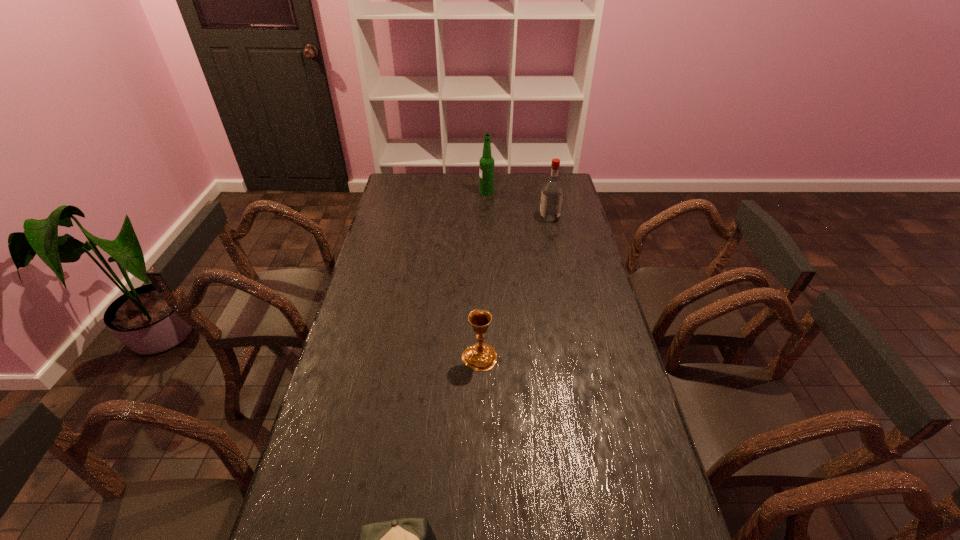
You are a GUI agent. You are given a task and a screenshot of the screen. Output one action in this format:
    pyautogui.click(x=<x>, y=<y>)
    Task: Click on the free space between the third farthest object and the beer bottle
    Image resolution: width=960 pixels, height=540 pixels.
    Given the screenshot: What is the action you would take?
    pyautogui.click(x=483, y=275)

Image resolution: width=960 pixels, height=540 pixels. In order to click on vacant area that lies between the chalice and the beer bottle in this screenshot , I will do `click(483, 275)`.

Where is `free space between the beer bottle and the third tallest object`? The width and height of the screenshot is (960, 540). free space between the beer bottle and the third tallest object is located at coordinates (483, 275).

At what (x,y) coordinates should I click in order to perform the action: click on unoccupied area between the beer bottle and the second shortest object. Please return your answer as a coordinate pair (x, y). The image size is (960, 540). Looking at the image, I should click on (483, 275).

Identify which object is the third nearest to the chalice. Please provide its 2D coordinates. Your answer should be formatted as a tuple, i.e. [(x, y)], where the tuple contains the x and y coordinates of a point satisfying the conditions above.

[(486, 163)]

This screenshot has height=540, width=960. Identify the location of object that is the second closest to the farthest object. (481, 357).